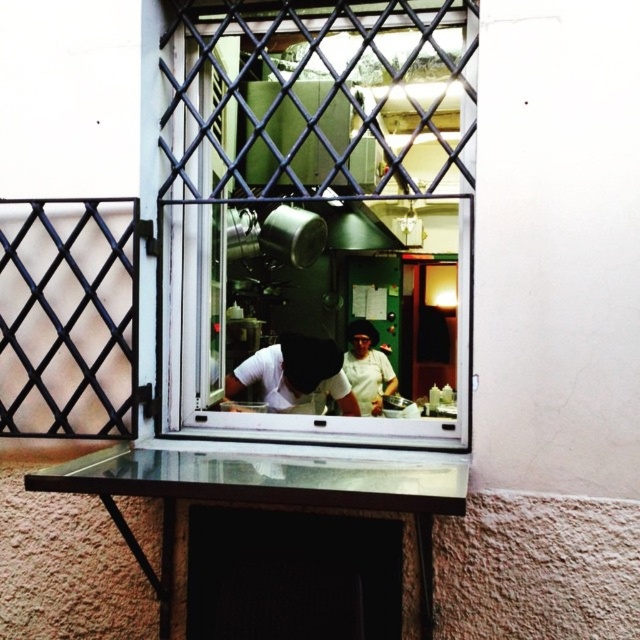
You are standing outside the window and want to see both the clear glass window at center and the white matte shirt at center. Which one will block your view more?

The clear glass window at center is larger in size than the white matte shirt at center, so it will block your view more.

You are a delivery person standing outside the window. You need to hand a package to the person inside. The clear glass window at center is partially open. Can you reach the white matte shirt at center through the opening?

The clear glass window at center is positioned over the white matte shirt at center, so the opening allows you to reach the white matte shirt at center.